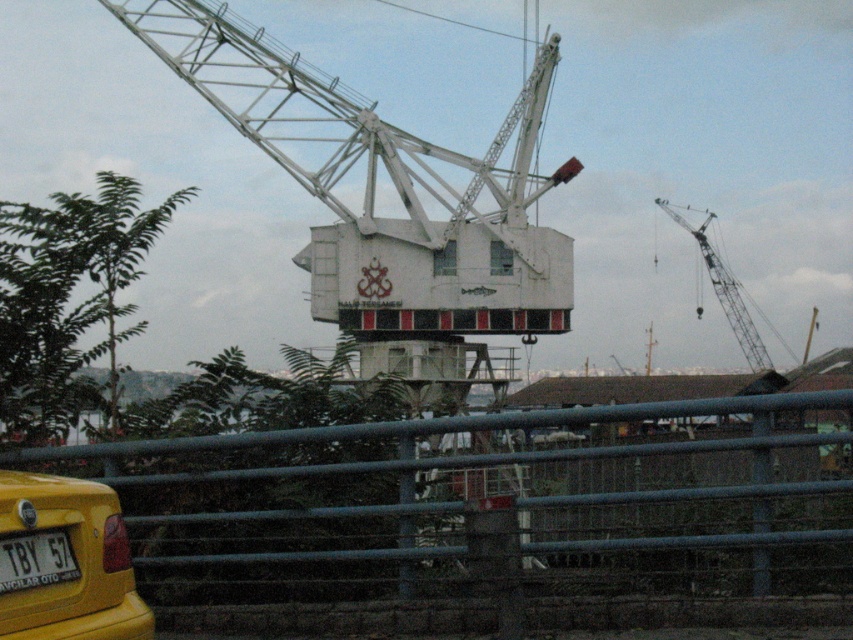
Question: Which of the following is the closest to the observer?

Choices:
 (A) (178, 506)
 (B) (80, 516)
 (C) (57, 561)
 (D) (735, 296)

Answer: (C)

Question: Can you confirm if yellow matte taxi at lower left is wider than yellow plastic license plate at lower left?

Choices:
 (A) no
 (B) yes

Answer: (B)

Question: Which of these objects is positioned farthest from the white metallic crane at upper right?

Choices:
 (A) yellow matte taxi at lower left
 (B) metallic gray fence at lower center

Answer: (A)

Question: Which point is farther to the camera?

Choices:
 (A) (24, 492)
 (B) (26, 557)
 (C) (285, 520)
 (D) (746, 314)

Answer: (D)

Question: Is yellow matte taxi at lower left positioned in front of yellow plastic license plate at lower left?

Choices:
 (A) yes
 (B) no

Answer: (A)

Question: Is metallic gray fence at lower center smaller than yellow plastic license plate at lower left?

Choices:
 (A) no
 (B) yes

Answer: (A)